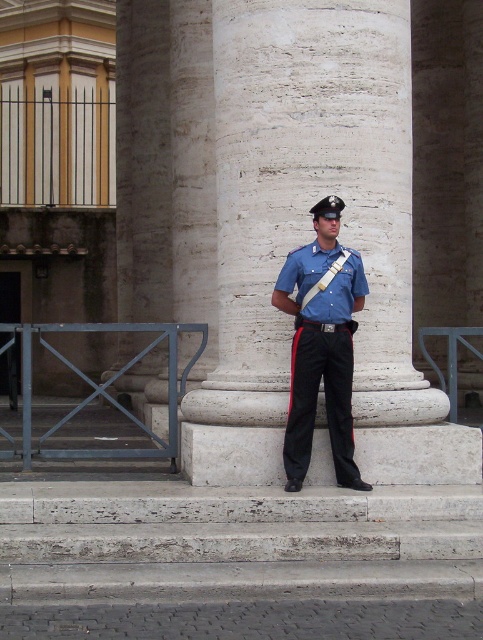
Image resolution: width=483 pixels, height=640 pixels. What do you see at coordinates (312, 230) in the screenshot? I see `white marble column at center` at bounding box center [312, 230].

Who is positioned more to the left, white marble column at center or white stone steps at center?

From the viewer's perspective, white stone steps at center appears more on the left side.

What do you see at coordinates (312, 230) in the screenshot? The width and height of the screenshot is (483, 640). I see `white marble column at center` at bounding box center [312, 230].

Where is `white marble column at center`? white marble column at center is located at coordinates (312, 230).

Does white marble column at center appear under blue uniform at center?

Actually, white marble column at center is above blue uniform at center.

Locate an element on the screen. This screenshot has height=640, width=483. white marble column at center is located at coordinates (312, 230).

Does white stone steps at center appear over blue uniform at center?

No.

Does white stone steps at center have a greater width compared to blue uniform at center?

Yes.

Does point (186, 554) come farther from viewer compared to point (294, 461)?

No, it is in front of (294, 461).

This screenshot has height=640, width=483. Find the location of `white stone steps at center`. white stone steps at center is located at coordinates (237, 540).